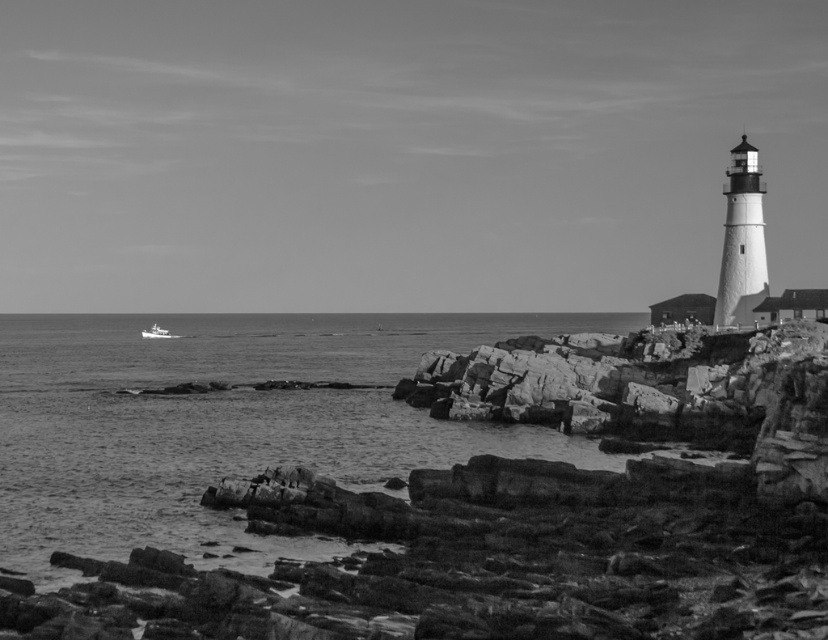
You are a photographer planning to capture a wide shot of the lighthouse and its surroundings. You notice the smooth water at lower left and the white plastic boat at left. Which object should you focus on if you want to include the larger one in your composition?

The smooth water at lower left is bigger than the white plastic boat at left, so you should focus on the smooth water at lower left to include the larger object in your composition.

You are standing at the lighthouse on the right side of the frame and want to walk towards the point with coordinates point (136,346) and point (162,339). Which point should you walk towards to reach the one closer to the lighthouse first?

You should walk towards point (136,346) first because it is in front of point (162,339), meaning it is closer to the lighthouse.

You are a photographer planning to capture the white plastic boat at left and the smooth water at lower left in a single frame. Based on the scene, which object occupies a wider area in the image?

The smooth water at lower left occupies a wider area in the image than the white plastic boat at left.